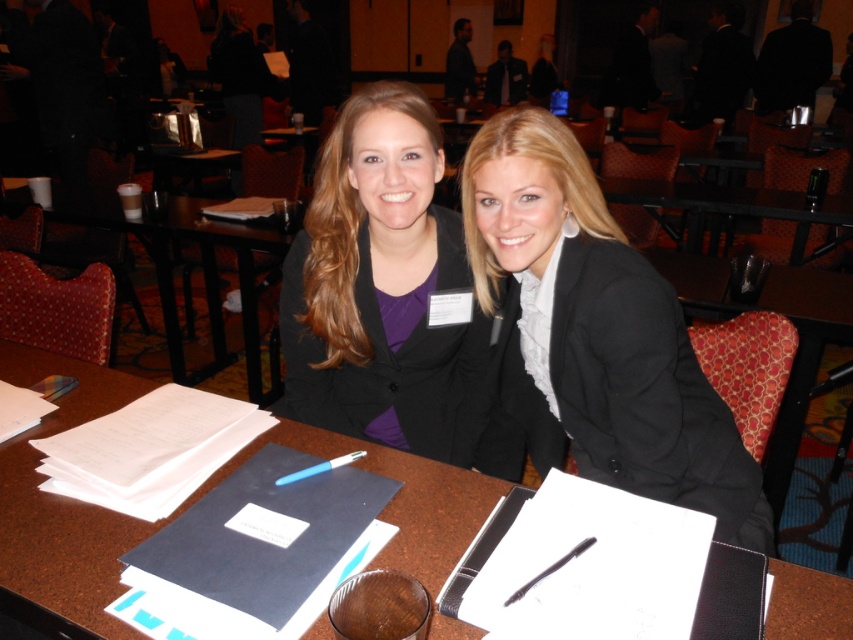
Can you confirm if matte black blazer at center is bigger than brown wooden table at center?

Incorrect, matte black blazer at center is not larger than brown wooden table at center.

Can you confirm if matte black blazer at center is thinner than brown wooden table at center?

Yes, matte black blazer at center is thinner than brown wooden table at center.

Which is behind, point (288, 300) or point (259, 232)?

The point (259, 232) is more distant.

You are a GUI agent. You are given a task and a screenshot of the screen. Output one action in this format:
    pyautogui.click(x=<x>, y=<y>)
    Task: Click on the matte black blazer at center
    This screenshot has height=640, width=853.
    Given the screenshot: What is the action you would take?
    pyautogui.click(x=383, y=289)

Does black matte blazer at center appear on the left side of matte black blazer at center?

In fact, black matte blazer at center is to the right of matte black blazer at center.

Does black matte blazer at center lie behind matte black blazer at center?

No, it is in front of matte black blazer at center.

Find the location of a particular element. This screenshot has width=853, height=640. black matte blazer at center is located at coordinates (592, 337).

Where is `black matte blazer at center`? This screenshot has width=853, height=640. black matte blazer at center is located at coordinates (592, 337).

Between brown wood table at center and brown wooden table at center, which one appears on the left side from the viewer's perspective?

Positioned to the left is brown wooden table at center.

Who is taller, brown wood table at center or brown wooden table at center?

With more height is brown wooden table at center.

The height and width of the screenshot is (640, 853). Identify the location of brown wood table at center. (62, 504).

In order to click on brown wood table at center in this screenshot , I will do `click(62, 504)`.